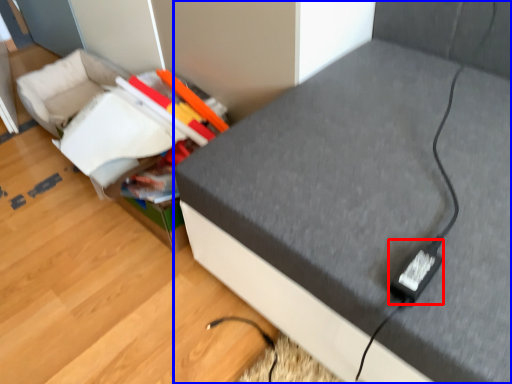
Question: Which object is closer to the camera taking this photo, plug (highlighted by a red box) or furniture (highlighted by a blue box)?

Choices:
 (A) plug
 (B) furniture

Answer: (B)